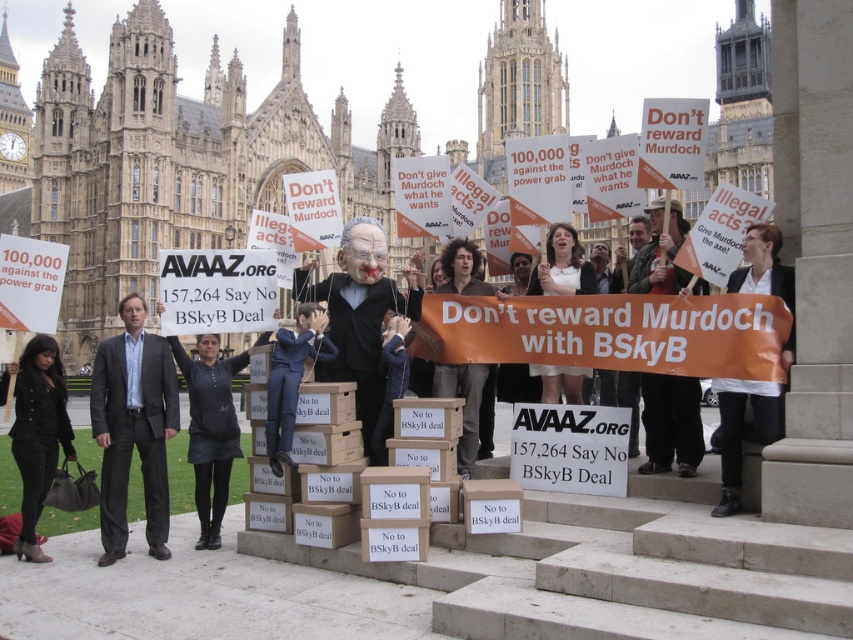
Question: Which point is farther from the camera taking this photo?

Choices:
 (A) (567, 228)
 (B) (374, 253)
 (C) (793, 324)
 (D) (468, 413)

Answer: (A)

Question: Does dark gray suit at center come behind black leather jacket at lower left?

Choices:
 (A) no
 (B) yes

Answer: (A)

Question: Does matte black suit at center appear on the left side of dark brown leather shoes at lower right?

Choices:
 (A) yes
 (B) no

Answer: (A)

Question: Is matte blue suit at center to the right of orange paper sign at center from the viewer's perspective?

Choices:
 (A) yes
 (B) no

Answer: (B)

Question: Estimate the real-world distances between objects in this image. Which object is farther from the white shirt at center?

Choices:
 (A) white fabric sign at center
 (B) orange paper sign at center
 (C) matte blue suit at center
 (D) matte black suit at center

Answer: (C)

Question: Which of the following is the farthest from the observer?

Choices:
 (A) (459, 282)
 (B) (381, 396)
 (C) (310, 326)
 (D) (572, 394)

Answer: (A)